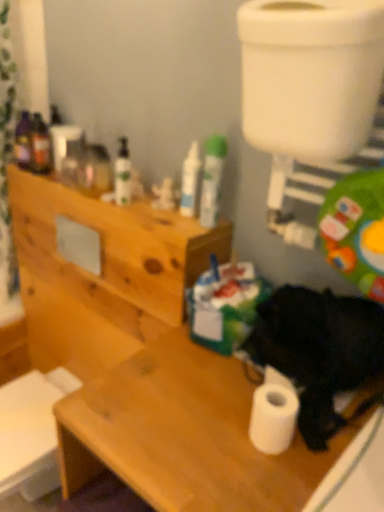
Question: Considering the relative positions of wooden cabinet at upper left and matte green bottle at upper center, which appears as the third toiletry when viewed from the right, in the image provided, is wooden cabinet at upper left in front of matte green bottle at upper center, which appears as the third toiletry when viewed from the right,?

Choices:
 (A) no
 (B) yes

Answer: (B)

Question: From the image's perspective, is wooden cabinet at upper left above matte green bottle at upper center, which appears as the third toiletry when viewed from the right?

Choices:
 (A) no
 (B) yes

Answer: (A)

Question: Is wooden cabinet at upper left far from matte green bottle at upper center, which appears as the third toiletry when viewed from the right?

Choices:
 (A) yes
 (B) no

Answer: (B)

Question: Can you confirm if wooden cabinet at upper left is smaller than matte green bottle at upper center, which appears as the 1th toiletry when viewed from the left?

Choices:
 (A) yes
 (B) no

Answer: (B)

Question: From a real-world perspective, is wooden cabinet at upper left below matte green bottle at upper center, which appears as the 1th toiletry when viewed from the left?

Choices:
 (A) yes
 (B) no

Answer: (A)

Question: Considering the positions of point pos(349,353) and point pos(38,182), is point pos(349,353) closer or farther from the camera than point pos(38,182)?

Choices:
 (A) closer
 (B) farther

Answer: (A)

Question: Is black fur dog at lower right taller or shorter than wooden cabinet at upper left?

Choices:
 (A) short
 (B) tall

Answer: (A)

Question: Considering their positions, is black fur dog at lower right located in front of or behind wooden cabinet at upper left?

Choices:
 (A) front
 (B) behind

Answer: (A)

Question: In terms of width, does black fur dog at lower right look wider or thinner when compared to wooden cabinet at upper left?

Choices:
 (A) wide
 (B) thin

Answer: (A)

Question: Looking at their shapes, would you say wooden desk at lower right is wider or thinner than matte green bottle at upper center, which appears as the 1th toiletry when viewed from the left?

Choices:
 (A) thin
 (B) wide

Answer: (B)

Question: From a real-world perspective, is wooden desk at lower right physically located above or below matte green bottle at upper center, which appears as the 1th toiletry when viewed from the left?

Choices:
 (A) above
 (B) below

Answer: (B)

Question: Is point (150, 495) closer or farther from the camera than point (119, 162)?

Choices:
 (A) farther
 (B) closer

Answer: (B)

Question: From the image's perspective, is wooden desk at lower right above or below matte green bottle at upper center, which appears as the 1th toiletry when viewed from the left?

Choices:
 (A) below
 (B) above

Answer: (A)

Question: From the image's perspective, is wooden cabinet at upper left above or below white matte tube at center, the 3th toiletry from the left?

Choices:
 (A) below
 (B) above

Answer: (A)

Question: Looking at their shapes, would you say wooden cabinet at upper left is wider or thinner than white matte tube at center, the 3th toiletry from the left?

Choices:
 (A) thin
 (B) wide

Answer: (B)